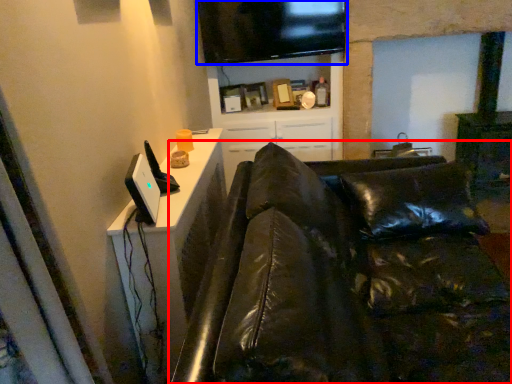
Question: Among these objects, which one is farthest to the camera, studio couch (highlighted by a red box) or television (highlighted by a blue box)?

Choices:
 (A) studio couch
 (B) television

Answer: (B)